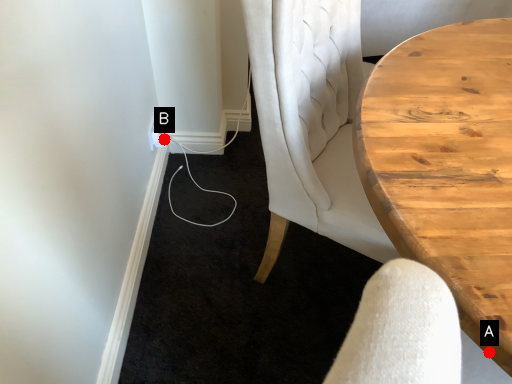
Question: Two points are circled on the image, labeled by A and B beside each circle. Which point is further to the camera?

Choices:
 (A) A is further
 (B) B is further

Answer: (B)